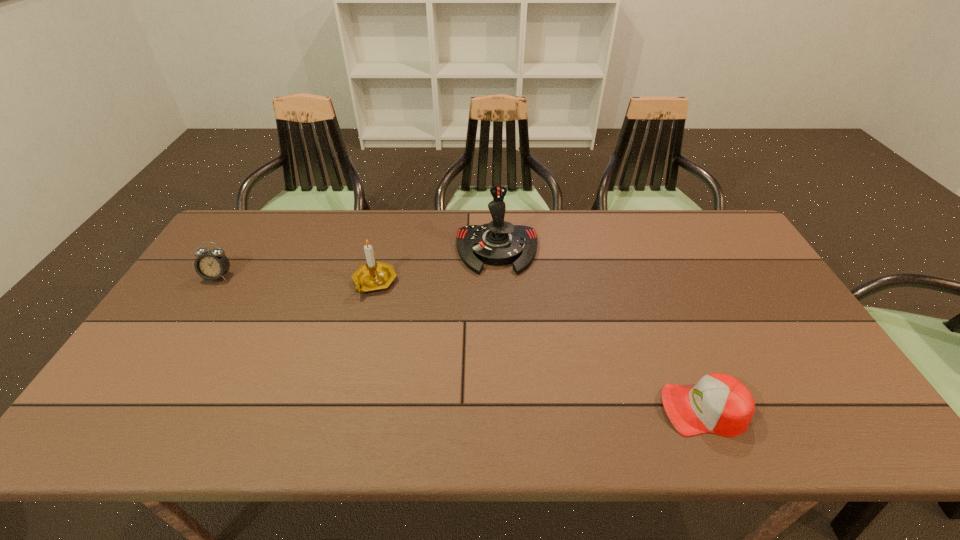
Image resolution: width=960 pixels, height=540 pixels. I want to click on the third object from left to right, so click(x=499, y=242).

The width and height of the screenshot is (960, 540). I want to click on the tallest object, so click(x=499, y=242).

Image resolution: width=960 pixels, height=540 pixels. In order to click on candle holder in this screenshot , I will do `click(374, 275)`.

This screenshot has width=960, height=540. I want to click on the third shortest object, so click(x=374, y=275).

You are a GUI agent. You are given a task and a screenshot of the screen. Output one action in this format:
    pyautogui.click(x=<x>, y=<y>)
    Task: Click on the leftmost object
    The width and height of the screenshot is (960, 540).
    Given the screenshot: What is the action you would take?
    pyautogui.click(x=211, y=265)

Identify the location of the second shortest object. [x=211, y=265].

Find the location of a particular element. The height and width of the screenshot is (540, 960). the rightmost object is located at coordinates (719, 403).

At what (x,y) coordinates should I click in order to perform the action: click on the nearest object. Please return your answer as a coordinate pair (x, y). This screenshot has width=960, height=540. Looking at the image, I should click on (719, 403).

At what (x,y) coordinates should I click in order to perform the action: click on vacant area situated 0.150m on the handle side of the third object from left to right. Please return your answer as a coordinate pair (x, y). Image resolution: width=960 pixels, height=540 pixels. Looking at the image, I should click on (500, 312).

What are the coordinates of `vacant space situated on the left of the candle holder` in the screenshot? It's located at (299, 282).